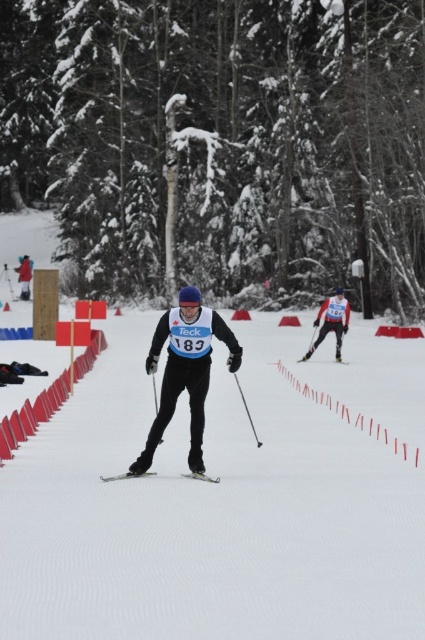
Is point (317, 592) in front of point (308, 356)?

Yes, it is in front of point (308, 356).

Does white snow ski slope at center have a larger size compared to matte black ski at right?

Yes, white snow ski slope at center is bigger than matte black ski at right.

Does point (180, 548) come farther from viewer compared to point (303, 356)?

No.

What are the coordinates of `white snow ski slope at center` in the screenshot? It's located at (223, 502).

Who is more distant from viewer, [28,273] or [300,358]?

The point [28,273] is behind.

Consider the image. Is matte black skier at left positioned behind matte black ski at right?

That is True.

Is point (30, 275) positioned before point (336, 362)?

No.

Where is `matte black skier at left`? This screenshot has height=640, width=425. matte black skier at left is located at coordinates (23, 276).

Does matte black skier at left have a lesser width compared to black plastic ski pole at center?

No.

Who is more distant from viewer, (31,268) or (255,440)?

The point (31,268) is behind.

Where is `matte black skier at left`? The image size is (425, 640). matte black skier at left is located at coordinates (23, 276).